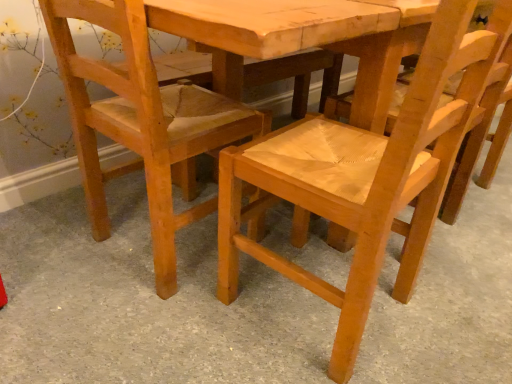
Question: Is natural wood chair at center aimed at natural wood chair at center, which appears as the 2th chair when viewed from the left?

Choices:
 (A) yes
 (B) no

Answer: (B)

Question: From the image's perspective, does natural wood chair at center appear higher than natural wood chair at center, which appears as the 2th chair when viewed from the left?

Choices:
 (A) no
 (B) yes

Answer: (A)

Question: Can you confirm if natural wood chair at center is taller than natural wood chair at center, which appears as the 2th chair when viewed from the left?

Choices:
 (A) no
 (B) yes

Answer: (A)

Question: Is the position of natural wood chair at center more distant than that of natural wood chair at center, which appears as the 2th chair when viewed from the left?

Choices:
 (A) yes
 (B) no

Answer: (B)

Question: Is natural wood chair at center facing away from natural wood chair at center, which appears as the 2th chair when viewed from the left?

Choices:
 (A) no
 (B) yes

Answer: (A)

Question: Considering the relative positions of natural wood chair at center and natural wood chair at center, the first chair from the right, in the image provided, is natural wood chair at center in front of natural wood chair at center, the first chair from the right,?

Choices:
 (A) yes
 (B) no

Answer: (A)

Question: Is natural wood chair at center, the first chair from the right, turned away from light brown wood chair at lower left, which ranks as the 1th chair in left-to-right order?

Choices:
 (A) yes
 (B) no

Answer: (B)

Question: Is natural wood chair at center, the first chair from the right, located outside light brown wood chair at lower left, which ranks as the 1th chair in left-to-right order?

Choices:
 (A) no
 (B) yes

Answer: (B)

Question: Is natural wood chair at center, which appears as the 2th chair when viewed from the left, wider than light brown wood chair at lower left, which ranks as the 1th chair in left-to-right order?

Choices:
 (A) yes
 (B) no

Answer: (B)

Question: Does natural wood chair at center, which appears as the 2th chair when viewed from the left, have a lesser width compared to light brown wood chair at lower left, the second chair positioned from the right?

Choices:
 (A) yes
 (B) no

Answer: (A)

Question: Is natural wood chair at center, which appears as the 2th chair when viewed from the left, closer to camera compared to light brown wood chair at lower left, which ranks as the 1th chair in left-to-right order?

Choices:
 (A) yes
 (B) no

Answer: (A)

Question: Is there a large distance between natural wood chair at center, the first chair from the right, and light brown wood chair at lower left, the second chair positioned from the right?

Choices:
 (A) yes
 (B) no

Answer: (B)

Question: Is light brown wood chair at lower left, which ranks as the 1th chair in left-to-right order, oriented away from natural wood chair at center, which appears as the 2th chair when viewed from the left?

Choices:
 (A) yes
 (B) no

Answer: (B)